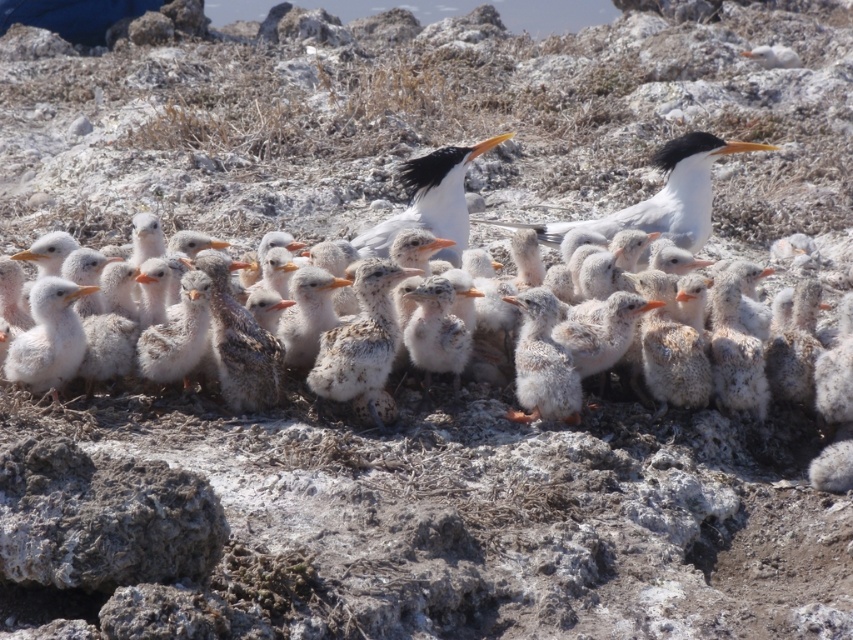
Question: Which is nearer to the white glossy bird at upper center?

Choices:
 (A) white fluffy bird at center
 (B) white feathered bird at center
 (C) white fluffy chick at left

Answer: (B)

Question: Can you confirm if white glossy bird at upper center is wider than white fluffy chick at left?

Choices:
 (A) yes
 (B) no

Answer: (A)

Question: Does white fluffy bird at center appear over white feathered bird at center?

Choices:
 (A) no
 (B) yes

Answer: (A)

Question: Among these points, which one is farthest from the camera?

Choices:
 (A) pos(682,218)
 (B) pos(730,310)

Answer: (A)

Question: Considering the real-world distances, which object is closest to the white glossy bird at upper center?

Choices:
 (A) white fluffy bird at center
 (B) white feathered bird at center

Answer: (B)

Question: Is white glossy bird at upper center to the left of white feathered bird at center from the viewer's perspective?

Choices:
 (A) no
 (B) yes

Answer: (A)